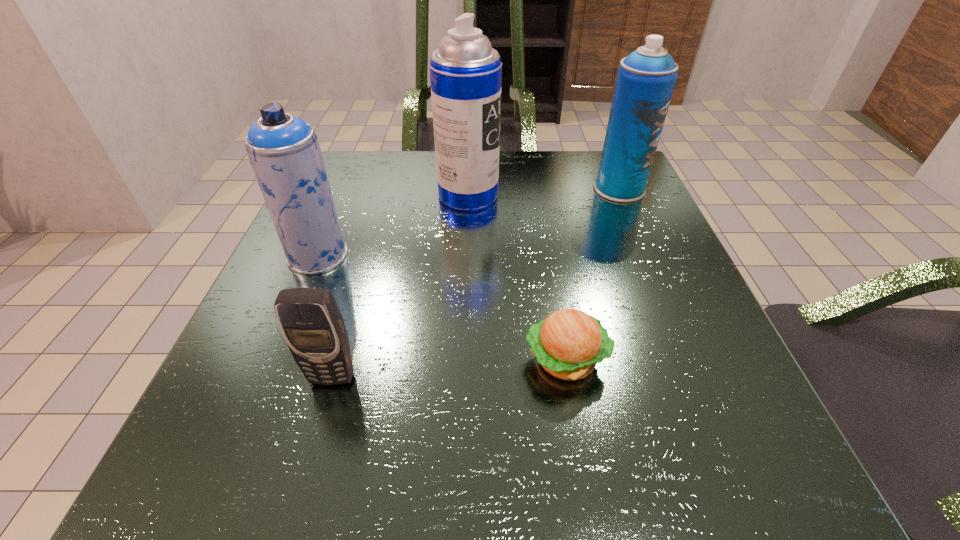
In order to click on vacant space that is in between the second aerosol can from left to right and the rightmost object in this screenshot , I will do `click(543, 192)`.

Locate an element on the screen. The image size is (960, 540). unoccupied position between the rightmost aerosol can and the third object from right to left is located at coordinates (543, 192).

Identify the location of vacant point located between the rightmost aerosol can and the shortest object. click(x=592, y=274).

At what (x,y) coordinates should I click in order to perform the action: click on object that stands as the third closest to the rightmost aerosol can. Please return your answer as a coordinate pair (x, y). Image resolution: width=960 pixels, height=540 pixels. Looking at the image, I should click on (284, 151).

Choose which object is the third nearest neighbor to the cellular telephone. Please provide its 2D coordinates. Your answer should be formatted as a tuple, i.e. [(x, y)], where the tuple contains the x and y coordinates of a point satisfying the conditions above.

[(465, 72)]

The image size is (960, 540). I want to click on aerosol can that is the second nearest to the fourth tallest object, so click(x=465, y=72).

You are a GUI agent. You are given a task and a screenshot of the screen. Output one action in this format:
    pyautogui.click(x=<x>, y=<y>)
    Task: Click on the aerosol can that stands as the second closest to the leftmost aerosol can
    The height and width of the screenshot is (540, 960).
    Given the screenshot: What is the action you would take?
    pyautogui.click(x=646, y=78)

Find the location of a particular element. The image size is (960, 540). free space that satisfies the following two spatial constraints: 1. on the label side of the second aerosol can from left to right; 2. on the front face of the second shortest object is located at coordinates (462, 377).

Find the location of a particular element. free space that satisfies the following two spatial constraints: 1. on the label side of the third object from right to left; 2. on the back side of the fourth object from left to right is located at coordinates (463, 360).

Where is `free location that satisfies the following two spatial constraints: 1. on the label side of the second object from right to left; 2. on the left side of the third object from left to right`? This screenshot has width=960, height=540. free location that satisfies the following two spatial constraints: 1. on the label side of the second object from right to left; 2. on the left side of the third object from left to right is located at coordinates (463, 360).